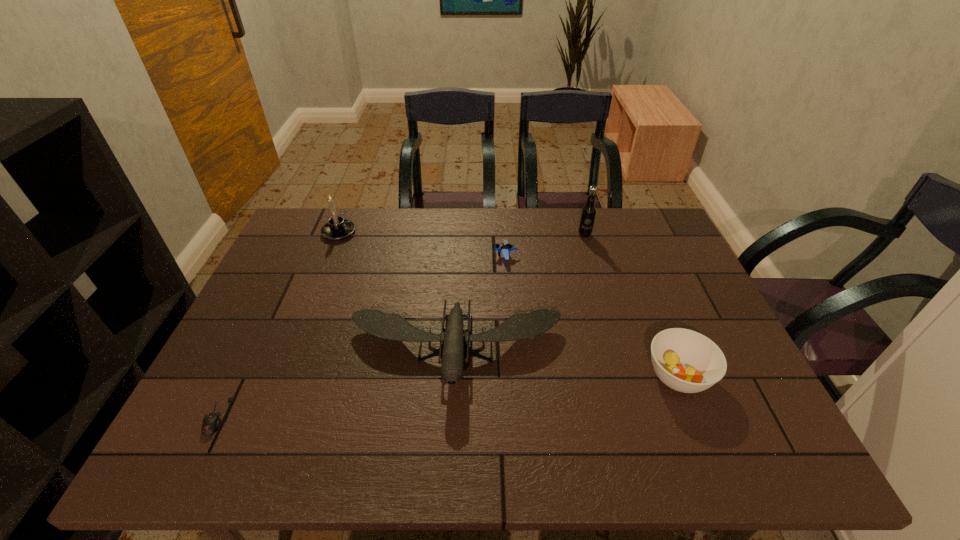
Where is `candle holder that is positioned at the far edge`? The image size is (960, 540). candle holder that is positioned at the far edge is located at coordinates (337, 228).

Identify the location of Lego at the far edge. (505, 248).

Where is `object located in the near edge section of the desktop`? The height and width of the screenshot is (540, 960). object located in the near edge section of the desktop is located at coordinates (211, 422).

This screenshot has width=960, height=540. What are the coordinates of `candle holder present at the left edge` in the screenshot? It's located at (337, 228).

Image resolution: width=960 pixels, height=540 pixels. In order to click on mouse that is at the left edge in this screenshot , I will do `click(211, 422)`.

You are a GUI agent. You are given a task and a screenshot of the screen. Output one action in this format:
    pyautogui.click(x=<x>, y=<y>)
    Task: Click on the object situated at the right edge
    This screenshot has width=960, height=540.
    Given the screenshot: What is the action you would take?
    pyautogui.click(x=686, y=361)

Locate an element on the screen. object located in the far left corner section of the desktop is located at coordinates (337, 228).

Locate an element on the screen. object that is at the near left corner is located at coordinates (211, 422).

Identify the location of free space at the far edge of the desktop. (384, 240).

You are a GUI agent. You are given a task and a screenshot of the screen. Output one action in this format:
    pyautogui.click(x=<x>, y=<y>)
    Task: Click on the free region at the near edge
    The image size is (960, 540).
    Given the screenshot: What is the action you would take?
    pyautogui.click(x=511, y=460)